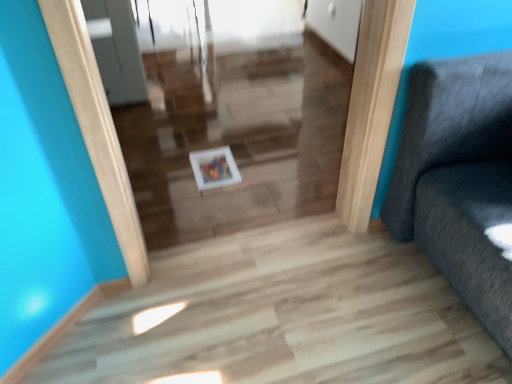
Locate an element on the screen. The height and width of the screenshot is (384, 512). white glossy picture frame at center is located at coordinates (214, 168).

What do you see at coordinates (214, 168) in the screenshot?
I see `white glossy picture frame at center` at bounding box center [214, 168].

What is the approximate width of white glossy tray at center?

white glossy tray at center is 10.55 inches wide.

The image size is (512, 384). Identify the location of white glossy tray at center. (x=236, y=139).

Describe the element at coordinates (236, 139) in the screenshot. I see `white glossy tray at center` at that location.

This screenshot has width=512, height=384. Identify the location of white glossy picture frame at center. (214, 168).

Is white glossy picture frame at center to the right of white glossy tray at center from the viewer's perspective?

Incorrect, white glossy picture frame at center is not on the right side of white glossy tray at center.

Between white glossy picture frame at center and white glossy tray at center, which one is positioned behind?

white glossy picture frame at center is further from the camera.

Is point (225, 158) closer or farther from the camera than point (305, 159)?

Clearly, point (225, 158) is more distant from the camera than point (305, 159).

From the image's perspective, which object appears higher, white glossy picture frame at center or white glossy tray at center?

white glossy tray at center, from the image's perspective.

From a real-world perspective, is white glossy picture frame at center positioned over white glossy tray at center based on gravity?

No.

In terms of width, does white glossy picture frame at center look wider or thinner when compared to white glossy tray at center?

white glossy picture frame at center is wider than white glossy tray at center.

In the scene shown: Between white glossy picture frame at center and white glossy tray at center, which one has less height?

white glossy picture frame at center.

Which of these two, white glossy picture frame at center or white glossy tray at center, is bigger?

white glossy tray at center is bigger.

Is white glossy picture frame at center situated inside white glossy tray at center or outside?

white glossy picture frame at center is not enclosed by white glossy tray at center.

Is white glossy picture frame at center next to white glossy tray at center?

No, white glossy picture frame at center is not making contact with white glossy tray at center.

Is white glossy picture frame at center looking in the opposite direction of white glossy tray at center?

No, white glossy picture frame at center's orientation is not away from white glossy tray at center.

In the scene shown: Can you tell me how much white glossy picture frame at center and white glossy tray at center differ in facing direction?

0.000679 degrees.

Identify the location of picture frame below the white glossy tray at center (from a real-world perspective). (214, 168).

Considering the positions of objects white glossy tray at center and white glossy picture frame at center in the image provided, who is more to the left, white glossy tray at center or white glossy picture frame at center?

From the viewer's perspective, white glossy picture frame at center appears more on the left side.

Is the position of white glossy tray at center more distant than that of white glossy picture frame at center?

No, it is in front of white glossy picture frame at center.

Is point (139, 204) less distant than point (220, 163)?

That is True.

From the image's perspective, between white glossy tray at center and white glossy picture frame at center, which one is located above?

From the image's view, white glossy tray at center is above.

From a real-world perspective, relative to white glossy picture frame at center, is white glossy tray at center vertically above or below?

white glossy tray at center is situated higher than white glossy picture frame at center in the real world.

Between white glossy tray at center and white glossy picture frame at center, which one has larger width?

With larger width is white glossy picture frame at center.

Considering the sizes of objects white glossy tray at center and white glossy picture frame at center in the image provided, who is taller, white glossy tray at center or white glossy picture frame at center?

Standing taller between the two is white glossy tray at center.

Is white glossy tray at center smaller than white glossy picture frame at center?

No, white glossy tray at center is not smaller than white glossy picture frame at center.

From the picture: Choose the correct answer: Is white glossy tray at center inside white glossy picture frame at center or outside it?

white glossy tray at center is not inside white glossy picture frame at center, it's outside.

Are white glossy tray at center and white glossy picture frame at center making contact?

white glossy tray at center and white glossy picture frame at center are not in contact.

Is white glossy tray at center turned away from white glossy picture frame at center?

Yes, white glossy tray at center is positioned with its back facing white glossy picture frame at center.

Identify the location of picture frame that appears below the white glossy tray at center (from the image's perspective). (214, 168).

The height and width of the screenshot is (384, 512). Find the location of `stairwell that appears above the white glossy picture frame at center (from the image's perspective)`. stairwell that appears above the white glossy picture frame at center (from the image's perspective) is located at coordinates (236, 139).

Locate an element on the screen. The width and height of the screenshot is (512, 384). stairwell located above the white glossy picture frame at center (from a real-world perspective) is located at coordinates (236, 139).